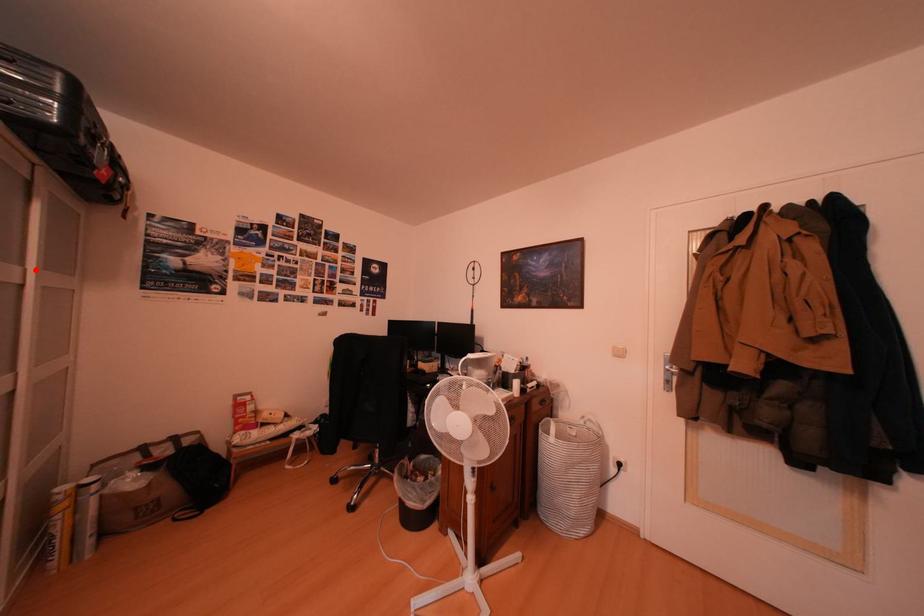
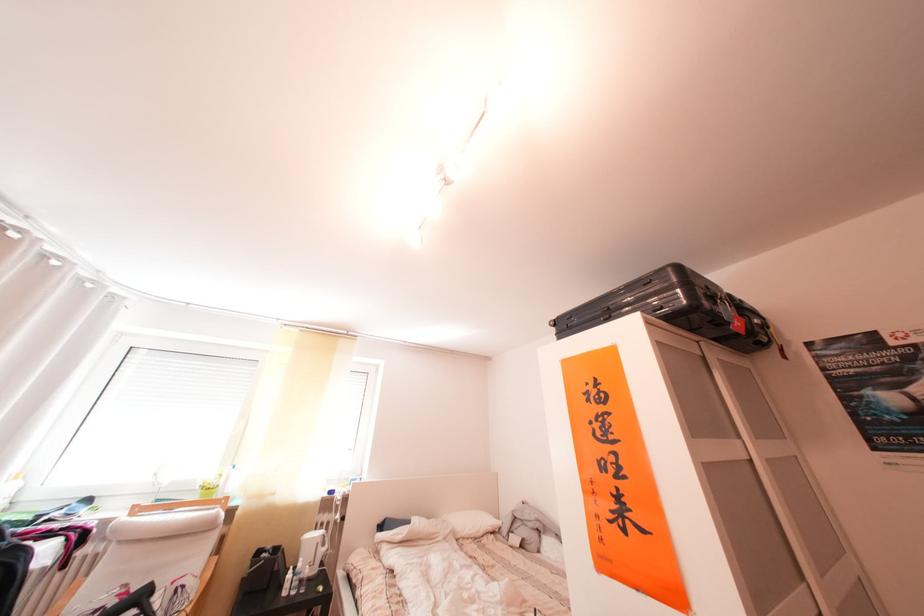
The point at the highlighted location is marked in the first image. Where is the corresponding point in the second image?

(751, 442)